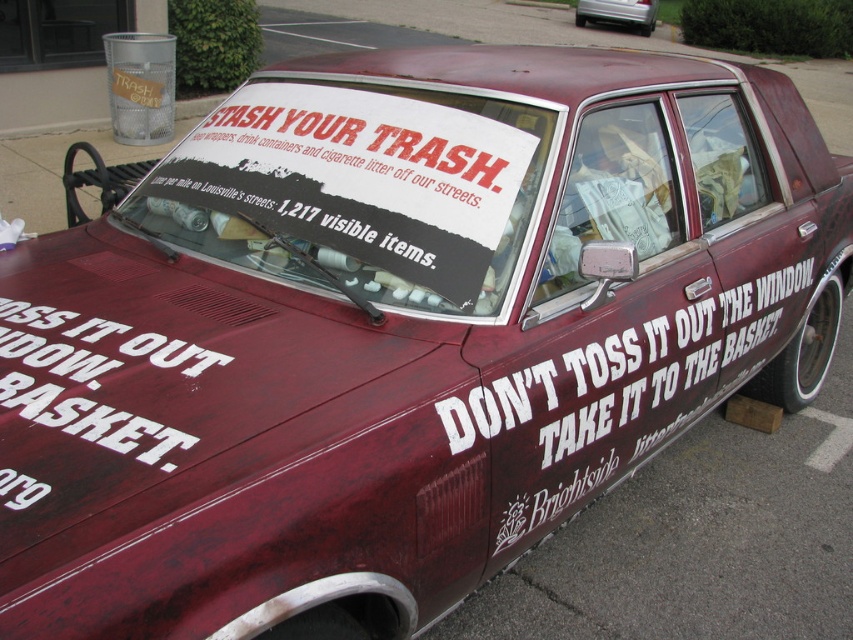
Does white painted text at lower left appear under maroon matte car at center?

Yes.

Can you confirm if white painted text at lower left is thinner than maroon matte car at center?

Correct, white painted text at lower left's width is less than maroon matte car at center's.

What do you see at coordinates (91, 380) in the screenshot? The height and width of the screenshot is (640, 853). I see `white painted text at lower left` at bounding box center [91, 380].

At what (x,y) coordinates should I click in order to perform the action: click on white painted text at lower left. Please return your answer as a coordinate pair (x, y). The height and width of the screenshot is (640, 853). Looking at the image, I should click on (91, 380).